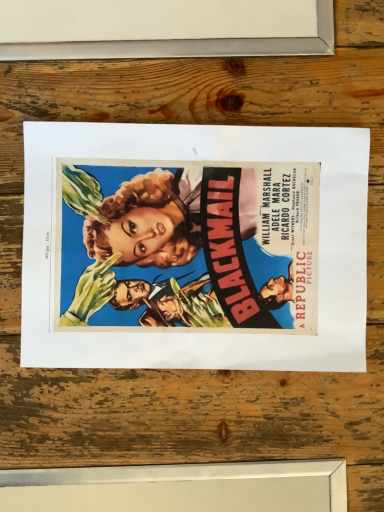
The height and width of the screenshot is (512, 384). Identify the location of free space above vibrant paper poster at center (from a real-world perspective). (203, 248).